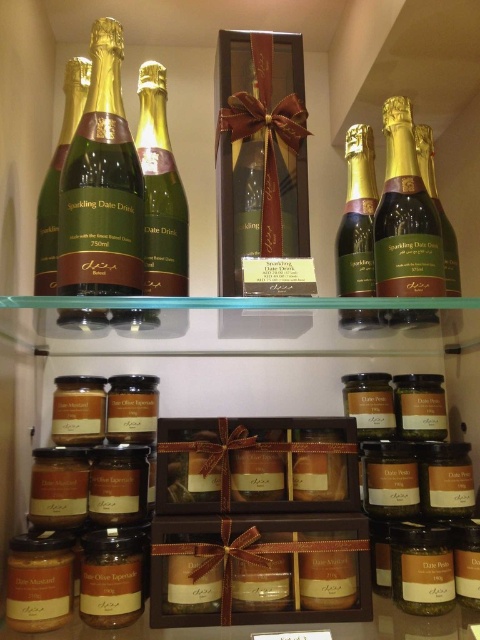
Question: Does gold foil champagne bottle at center appear on the right side of green glass bottle at left?

Choices:
 (A) no
 (B) yes

Answer: (B)

Question: Can you confirm if matte gold bottle at right is positioned below green glass bottle at center?

Choices:
 (A) no
 (B) yes

Answer: (B)

Question: Estimate the real-world distances between objects in this image. Which object is closer to the translucent glass jars at center?

Choices:
 (A) translucent amber jar at lower right
 (B) green glass bottle at left
 (C) matte gold champagne bottle at left
 (D) matte gold bottle at center

Answer: (C)

Question: Considering the real-world distances, which object is farthest from the translucent glass jars at center?

Choices:
 (A) green glass bottle at left
 (B) matte brown jar at center
 (C) matte gold bottle at center

Answer: (A)

Question: Can you confirm if matte gold bottle at right is positioned above matte brown jar at center?

Choices:
 (A) no
 (B) yes

Answer: (B)

Question: Which of these objects is positioned closest to the gold foil champagne bottle at center?

Choices:
 (A) matte brown jar at center
 (B) translucent glass jars at center

Answer: (B)